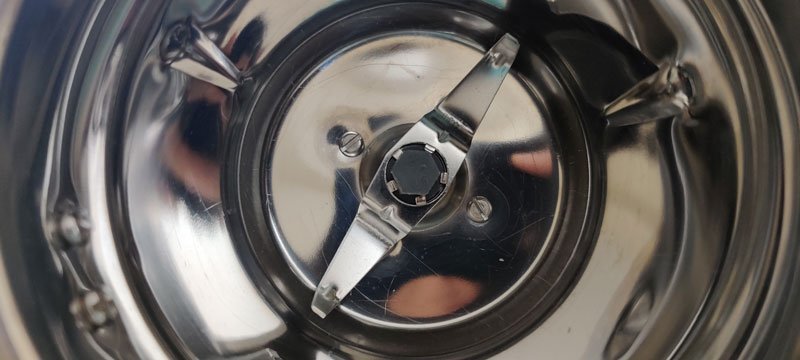
The width and height of the screenshot is (800, 360). I want to click on mirror reflection of person, so click(x=192, y=151), click(x=492, y=258).